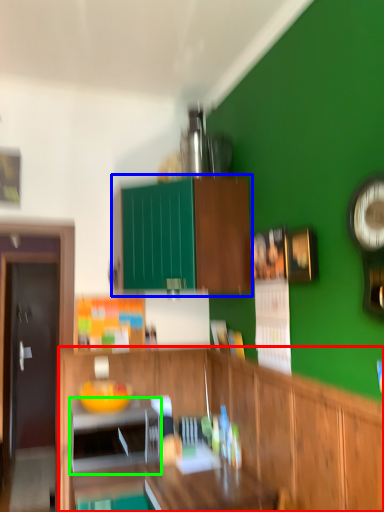
Question: Based on their relative distances, which object is farther from cabinetry (highlighted by a red box)? Choose from cabinetry (highlighted by a blue box) and appliance (highlighted by a green box).

Choices:
 (A) cabinetry
 (B) appliance

Answer: (A)